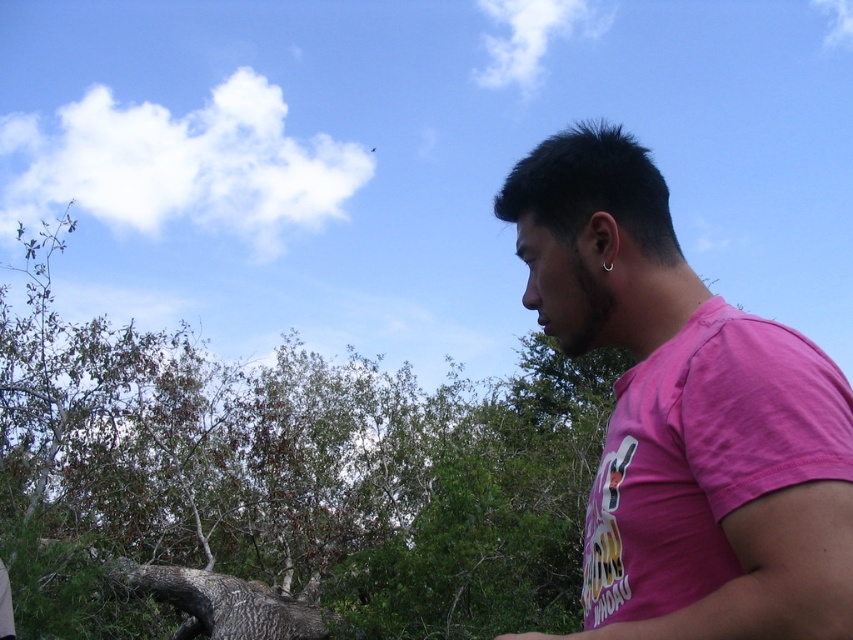
Does point (180, 572) come farther from viewer compared to point (669, 480)?

Yes, it is behind point (669, 480).

Is green leafy tree at center smaller than pink cotton shirt at right?

No.

Between point (511, 554) and point (688, 609), which one is positioned behind?

Positioned behind is point (511, 554).

Find the location of a particular element. This screenshot has width=853, height=640. green leafy tree at center is located at coordinates (281, 483).